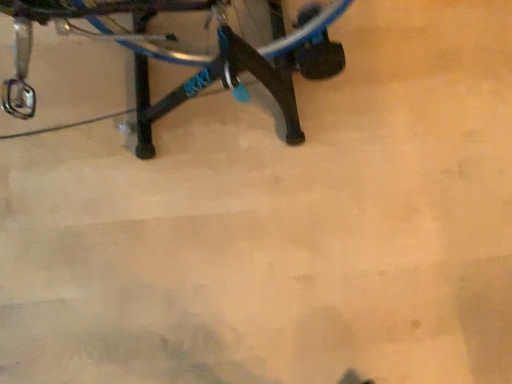
Find the location of a particular element. vacant space in black matte bicycle at center (from a real-world perspective) is located at coordinates (125, 90).